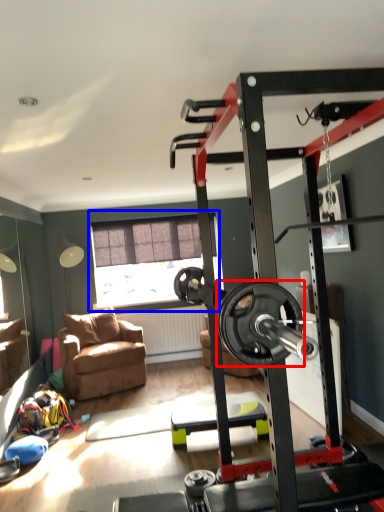
Question: Which point is further to the camera, wheel (highlighted by a red box) or window (highlighted by a blue box)?

Choices:
 (A) wheel
 (B) window

Answer: (B)